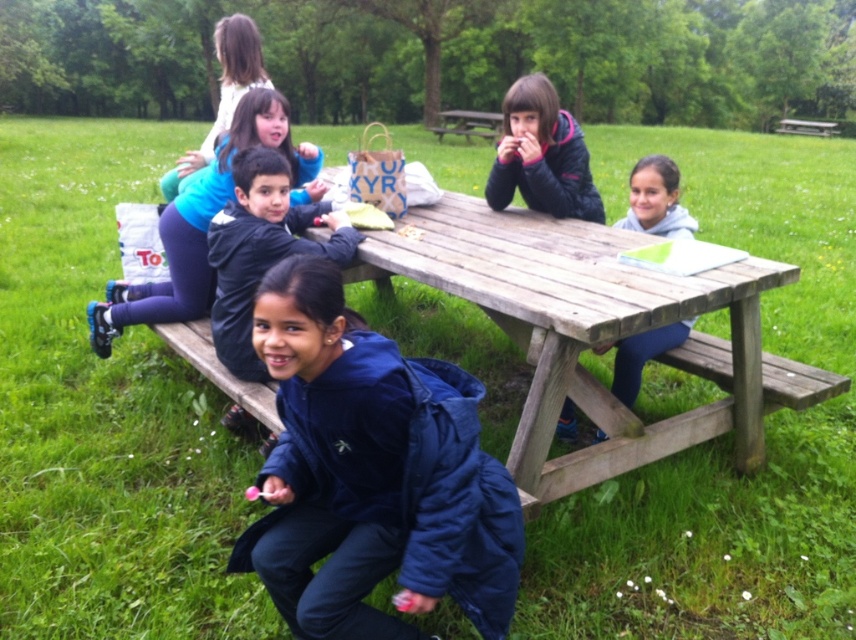
Who is positioned more to the right, blue fabric jacket at lower center or wooden bench at upper right?

Positioned to the right is wooden bench at upper right.

Is blue fabric jacket at lower center to the right of wooden bench at upper right from the viewer's perspective?

In fact, blue fabric jacket at lower center is to the left of wooden bench at upper right.

This screenshot has width=856, height=640. Describe the element at coordinates (203, 225) in the screenshot. I see `blue fabric jacket at lower center` at that location.

You are a GUI agent. You are given a task and a screenshot of the screen. Output one action in this format:
    pyautogui.click(x=<x>, y=<y>)
    Task: Click on the blue fabric jacket at lower center
    Image resolution: width=856 pixels, height=640 pixels.
    Given the screenshot: What is the action you would take?
    pyautogui.click(x=203, y=225)

In the scene shown: Can you confirm if dark blue fleece at center is thinner than blue fabric jacket at lower center?

Indeed, dark blue fleece at center has a lesser width compared to blue fabric jacket at lower center.

Where is `dark blue fleece at center`? The height and width of the screenshot is (640, 856). dark blue fleece at center is located at coordinates (260, 248).

Does dark blue fleece jacket at lower center have a greater height compared to light blue jeans at lower right?

Correct, dark blue fleece jacket at lower center is much taller as light blue jeans at lower right.

Looking at this image, is dark blue fleece jacket at lower center positioned before light blue jeans at lower right?

Yes, it is.

Between point (480, 634) and point (658, 179), which one is positioned behind?

The point (658, 179) is more distant.

You are a GUI agent. You are given a task and a screenshot of the screen. Output one action in this format:
    pyautogui.click(x=<x>, y=<y>)
    Task: Click on the dark blue fleece jacket at lower center
    This screenshot has width=856, height=640.
    Given the screenshot: What is the action you would take?
    pyautogui.click(x=372, y=472)